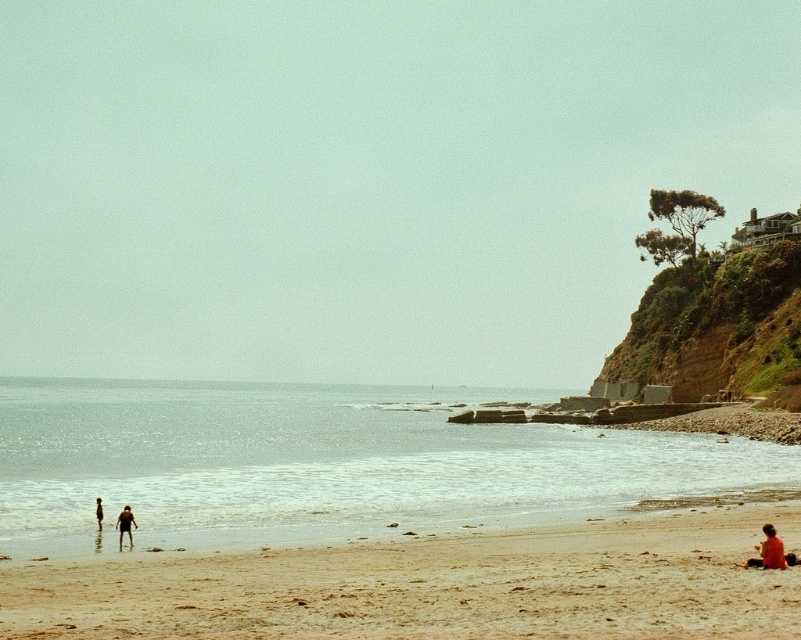
Question: Does red fabric person at lower right lie behind matte skin couple at lower left?

Choices:
 (A) yes
 (B) no

Answer: (B)

Question: Which object appears closest to the camera in this image?

Choices:
 (A) brown textured shorts at lower left
 (B) silhouette figure at lower left

Answer: (A)

Question: Among these objects, which one is farthest from the camera?

Choices:
 (A) green mossy rock at upper right
 (B) silhouette figure at lower left

Answer: (A)

Question: Among these objects, which one is nearest to the camera?

Choices:
 (A) red fabric person at lower right
 (B) brown textured shorts at lower left
 (C) silhouette figure at lower left
 (D) clear blue water at lower center

Answer: (A)

Question: Does green mossy rock at upper right lie behind brown textured shorts at lower left?

Choices:
 (A) no
 (B) yes

Answer: (B)

Question: Is matte skin couple at lower left smaller than brown textured shorts at lower left?

Choices:
 (A) no
 (B) yes

Answer: (A)